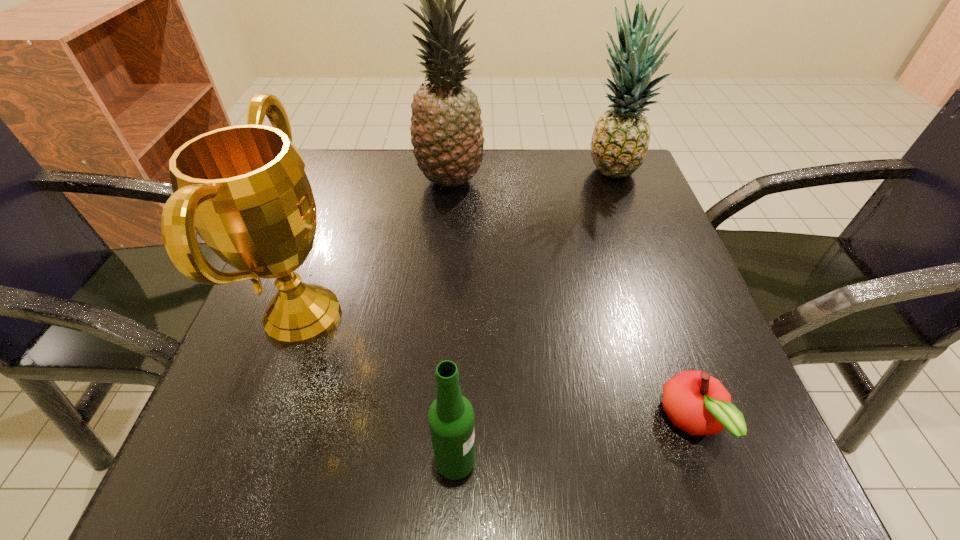
Image resolution: width=960 pixels, height=540 pixels. I want to click on vacant area that lies between the leftmost object and the second shortest object, so click(379, 388).

Image resolution: width=960 pixels, height=540 pixels. In order to click on free spot between the award and the fourth tallest object in this screenshot , I will do `click(379, 388)`.

Identify which object is located as the second nearest to the right pineapple. Please provide its 2D coordinates. Your answer should be formatted as a tuple, i.e. [(x, y)], where the tuple contains the x and y coordinates of a point satisfying the conditions above.

[(697, 403)]

This screenshot has height=540, width=960. In order to click on object that is the fourth closest to the apple in this screenshot , I will do `click(446, 133)`.

The width and height of the screenshot is (960, 540). I want to click on vacant space that satisfies the following two spatial constraints: 1. on the back side of the shortest object; 2. on the front-facing side of the leftmost object, so click(x=655, y=315).

Find the location of `vacant space that satisfies the following two spatial constraints: 1. on the front side of the left pineapple; 2. on the front-facing side of the award`. vacant space that satisfies the following two spatial constraints: 1. on the front side of the left pineapple; 2. on the front-facing side of the award is located at coordinates (439, 315).

You are a GUI agent. You are given a task and a screenshot of the screen. Output one action in this format:
    pyautogui.click(x=<x>, y=<y>)
    Task: Click on the free space that satisfies the following two spatial constraints: 1. on the front side of the left pineapple; 2. on the front-facing side of the award
    
    Given the screenshot: What is the action you would take?
    pyautogui.click(x=439, y=315)

Where is `vacant space that satisfies the following two spatial constraints: 1. on the back side of the apple; 2. on the front-facing side of the award`? vacant space that satisfies the following two spatial constraints: 1. on the back side of the apple; 2. on the front-facing side of the award is located at coordinates (655, 315).